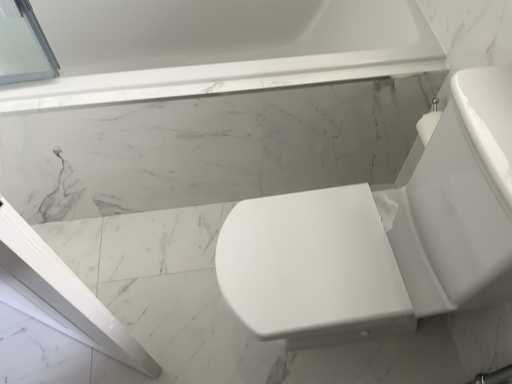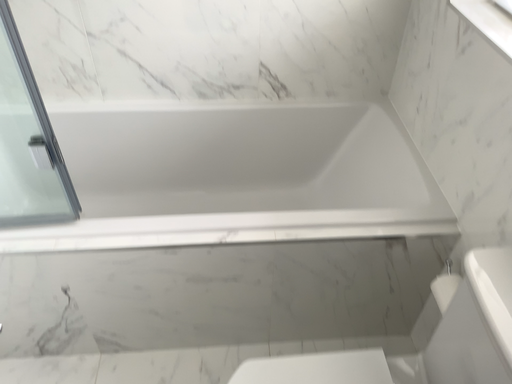
Question: Which way did the camera rotate in the video?

Choices:
 (A) rotated downward
 (B) rotated upward

Answer: (B)